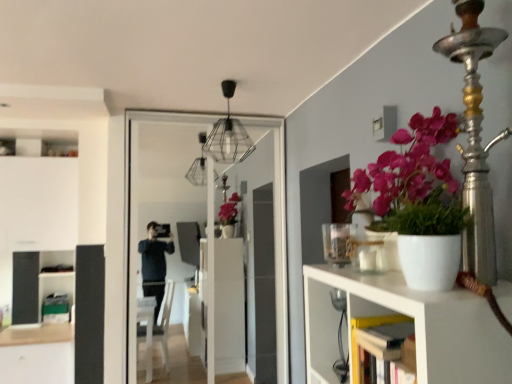
Question: Considering the relative sizes of white matte shelf at right and clear glass screen door at center in the image provided, is white matte shelf at right smaller than clear glass screen door at center?

Choices:
 (A) yes
 (B) no

Answer: (A)

Question: Considering the relative sizes of white matte shelf at right and clear glass screen door at center in the image provided, is white matte shelf at right thinner than clear glass screen door at center?

Choices:
 (A) yes
 (B) no

Answer: (B)

Question: Is white matte shelf at right to the left of clear glass screen door at center from the viewer's perspective?

Choices:
 (A) no
 (B) yes

Answer: (A)

Question: Is white matte shelf at right with clear glass screen door at center?

Choices:
 (A) no
 (B) yes

Answer: (A)

Question: Is white matte shelf at right to the right of clear glass screen door at center from the viewer's perspective?

Choices:
 (A) yes
 (B) no

Answer: (A)

Question: Does white matte shelf at right have a greater width compared to clear glass screen door at center?

Choices:
 (A) no
 (B) yes

Answer: (B)

Question: Is clear glass screen door at center facing away from white matte shelf at right?

Choices:
 (A) yes
 (B) no

Answer: (B)

Question: Can white matte shelf at right be found inside clear glass screen door at center?

Choices:
 (A) yes
 (B) no

Answer: (B)

Question: Is clear glass screen door at center far away from white matte shelf at right?

Choices:
 (A) no
 (B) yes

Answer: (B)

Question: Can you confirm if clear glass screen door at center is shorter than white matte shelf at right?

Choices:
 (A) yes
 (B) no

Answer: (B)

Question: From a real-world perspective, is clear glass screen door at center positioned under white matte shelf at right based on gravity?

Choices:
 (A) yes
 (B) no

Answer: (B)

Question: From the image's perspective, would you say clear glass screen door at center is positioned over white matte shelf at right?

Choices:
 (A) no
 (B) yes

Answer: (B)

Question: In the image, is white matte shelf at right positioned in front of or behind clear glass screen door at center?

Choices:
 (A) behind
 (B) front

Answer: (B)